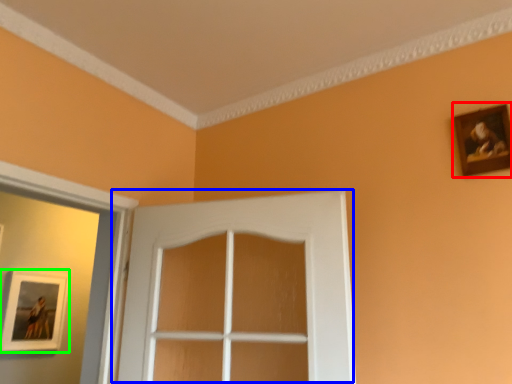
Question: Based on their relative distances, which object is nearer to picture frame (highlighted by a red box)? Choose from door (highlighted by a blue box) and picture frame (highlighted by a green box).

Choices:
 (A) door
 (B) picture frame

Answer: (A)